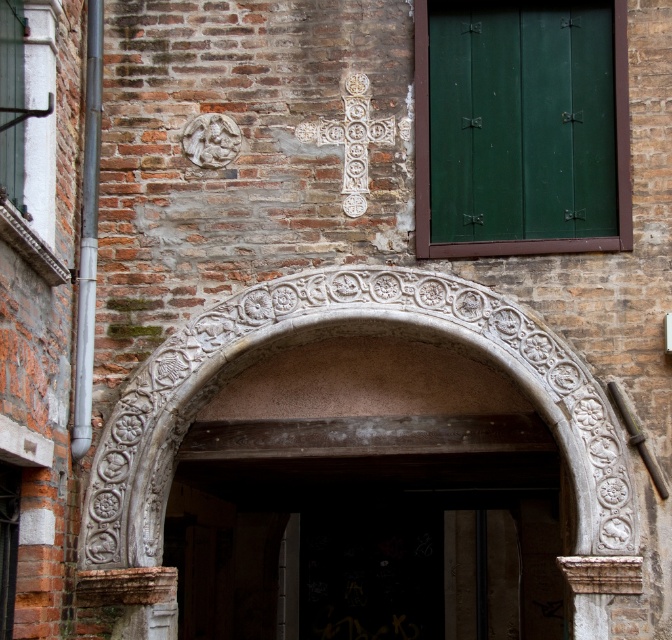
You are an architect examining the brick wall and notice two archways. The carved stone archway at center and the white stone archway at center. Which one is positioned lower?

The carved stone archway at center is below the white stone archway at center, so the carved stone archway at center is positioned lower.

You are an architect examining the brick wall and notice two archways. Which one is larger in size between the carved stone archway at center and the white stone archway at center?

The carved stone archway at center is bigger than the white stone archway at center according to the description provided.

You are standing in front of a historical building and want to take a photo of the carved stone archway at center. If your camera can focus on objects up to 20 meters away, will it be able to capture the archway clearly?

The carved stone archway at center is 17.21 meters away from the viewer, which is within the camera focus range of up to 20 meters. Therefore, the camera can capture the archway clearly.